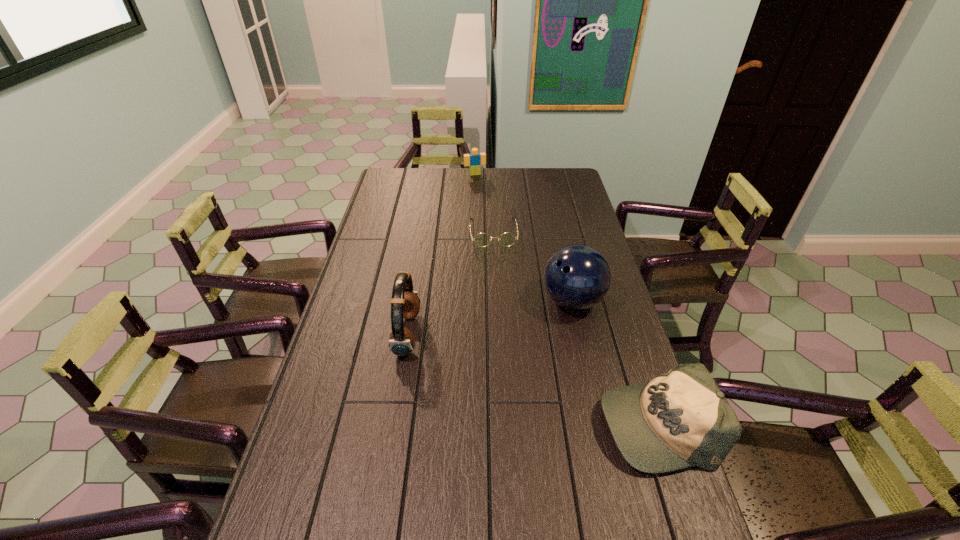
Locate an element on the screen. free space on the desktop that is between the headset and the baseball cap and is positioned on the surface of the bowling ball near the finger holes is located at coordinates click(505, 369).

Locate an element on the screen. This screenshot has height=540, width=960. free space on the desktop that is between the headset and the baseball cap and is positioned on the lenses of the shortest object is located at coordinates (507, 370).

Locate an element on the screen. The image size is (960, 540). free space on the desktop that is between the leftmost object and the nearest object and is positioned on the face of the farthest object is located at coordinates (557, 388).